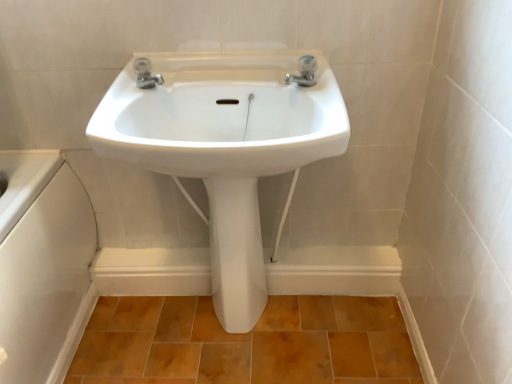
I want to click on spots to the right of white glossy pedestal at center, so click(294, 329).